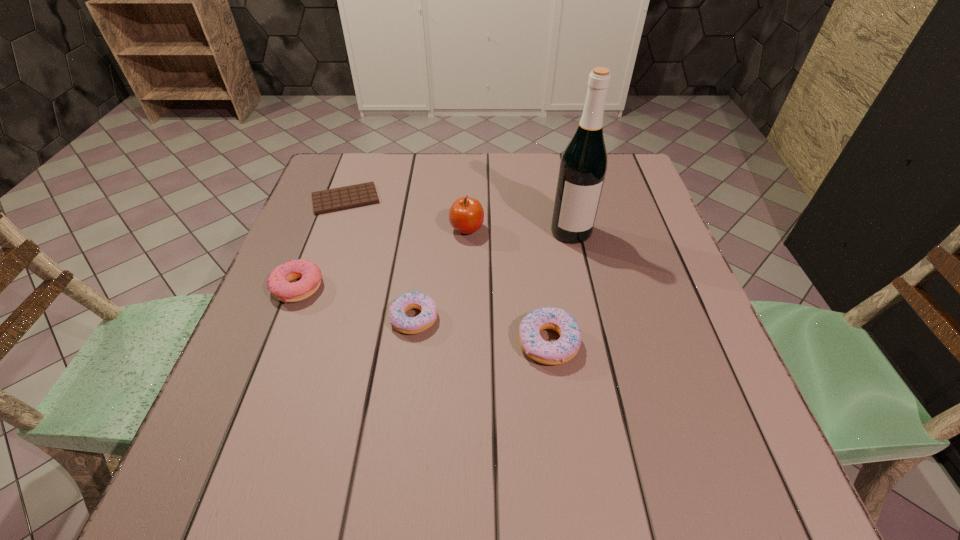
Where is `free space between the wine bottle and the third object from left to right`? free space between the wine bottle and the third object from left to right is located at coordinates (492, 275).

At what (x,y) coordinates should I click in order to perform the action: click on vacant space in between the leftmost doughnut and the third object from left to right. Please return your answer as a coordinate pair (x, y). Looking at the image, I should click on (356, 303).

Where is `unoccupied position between the second tallest object and the leftmost doughnut`? unoccupied position between the second tallest object and the leftmost doughnut is located at coordinates (382, 258).

I want to click on empty space between the fourth object from right to left and the leftmost doughnut, so click(x=356, y=303).

You are a GUI agent. You are given a task and a screenshot of the screen. Output one action in this format:
    pyautogui.click(x=<x>, y=<y>)
    Task: Click on the fourth closest object to the shortest object
    This screenshot has height=540, width=960.
    Given the screenshot: What is the action you would take?
    pyautogui.click(x=583, y=166)

Find the location of a particular element. the second closest object to the leftmost doughnut is located at coordinates (342, 198).

Locate an element on the screen. doughnut that stands as the second closest to the second doughnut from left to right is located at coordinates (566, 347).

Locate which doughnut is the closest to the fourth object from left to right. Please provide its 2D coordinates. Your answer should be formatted as a tuple, i.e. [(x, y)], where the tuple contains the x and y coordinates of a point satisfying the conditions above.

[(415, 300)]